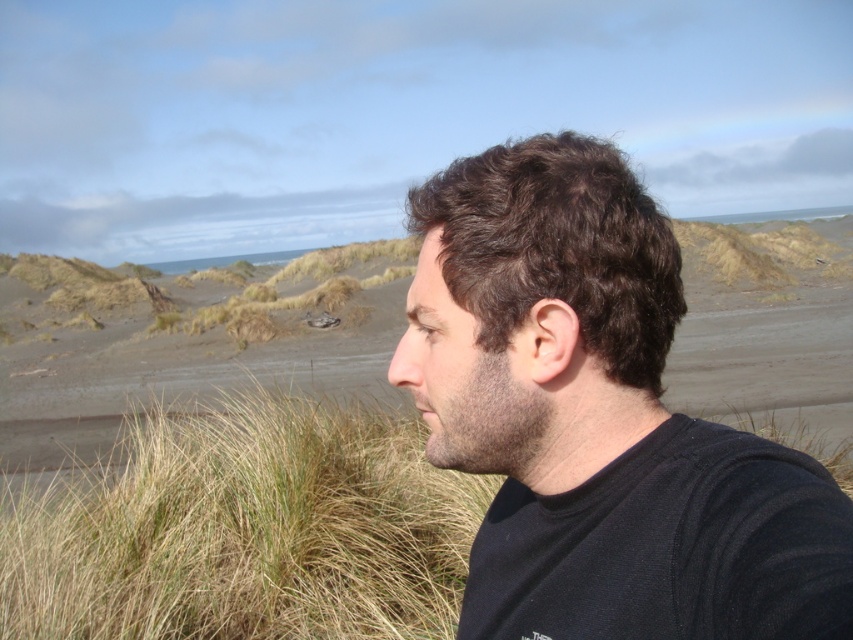
Question: Among these objects, which one is nearest to the camera?

Choices:
 (A) grassy textured grass at center
 (B) black matte shirt at center

Answer: (B)

Question: Considering the relative positions of black matte shirt at center and grassy textured grass at center in the image provided, where is black matte shirt at center located with respect to grassy textured grass at center?

Choices:
 (A) below
 (B) above

Answer: (B)

Question: Which point is closer to the camera taking this photo?

Choices:
 (A) (605, 275)
 (B) (364, 426)

Answer: (A)

Question: Is black matte shirt at center below grassy textured grass at center?

Choices:
 (A) no
 (B) yes

Answer: (A)

Question: Among these points, which one is farthest from the camera?

Choices:
 (A) (592, 200)
 (B) (260, 618)

Answer: (B)

Question: Does black matte shirt at center appear on the right side of grassy textured grass at center?

Choices:
 (A) no
 (B) yes

Answer: (B)